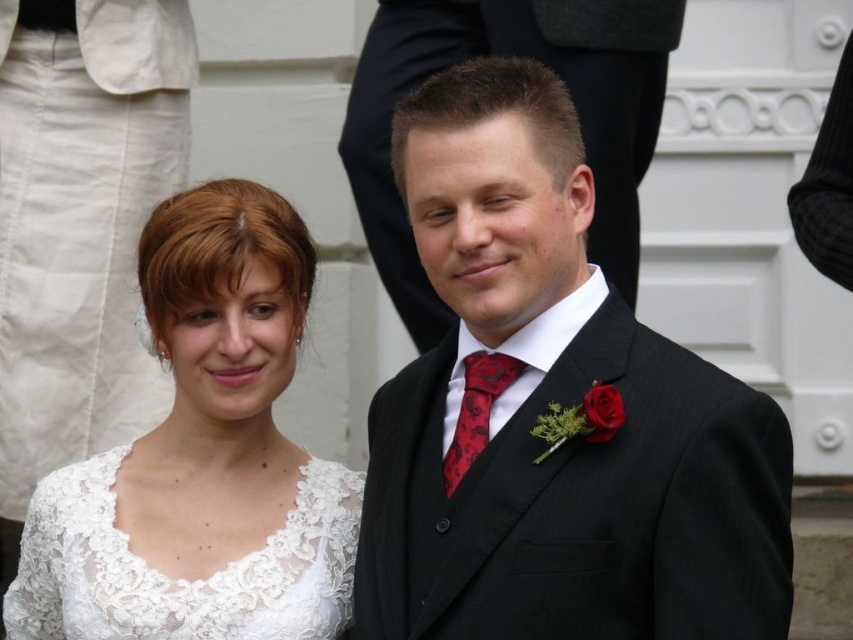
Question: Which object is positioned closest to the lace fabric dress at lower left?

Choices:
 (A) red satin tie at center
 (B) black pinstripe suit at center
 (C) white lace dress at center

Answer: (C)

Question: Is black pinstripe suit at center wider than white lace dress at center?

Choices:
 (A) no
 (B) yes

Answer: (A)

Question: Which point is farther to the camera?

Choices:
 (A) black pinstripe suit at center
 (B) white lace dress at center
 (C) red satin tie at center

Answer: (B)

Question: Which object is farther from the camera taking this photo?

Choices:
 (A) red satin tie at center
 (B) white lace dress at center

Answer: (B)

Question: Can you confirm if white lace dress at center is bigger than red satin tie at center?

Choices:
 (A) yes
 (B) no

Answer: (A)

Question: Considering the relative positions of lace fabric dress at lower left and red satin tie at center in the image provided, where is lace fabric dress at lower left located with respect to red satin tie at center?

Choices:
 (A) right
 (B) left

Answer: (B)